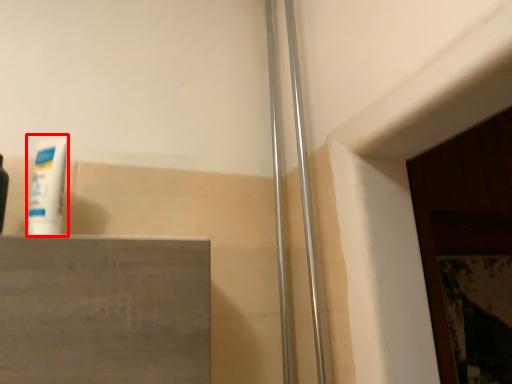
Question: From the image's perspective, what is the correct spatial relationship of toothpaste (annotated by the red box) in relation to shower door?

Choices:
 (A) below
 (B) above

Answer: (A)